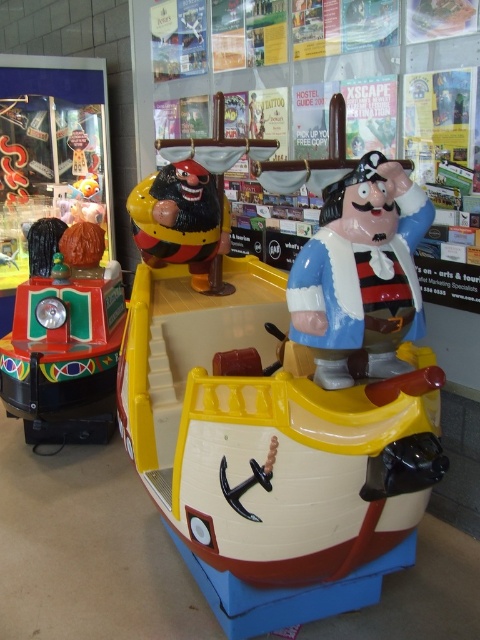
Question: Is shiny plastic pirate ship at center thinner than shiny green plastic train at left?

Choices:
 (A) yes
 (B) no

Answer: (B)

Question: Can you confirm if shiny plastic pirate ship at center is smaller than shiny green plastic train at left?

Choices:
 (A) yes
 (B) no

Answer: (B)

Question: Is shiny plastic pirate at center positioned in front of shiny green plastic train at left?

Choices:
 (A) no
 (B) yes

Answer: (B)

Question: Estimate the real-world distances between objects in this image. Which object is farther from the shiny plastic pirate ship at center?

Choices:
 (A) shiny green plastic train at left
 (B) shiny plastic pirate at center

Answer: (A)

Question: Which of the following is the closest to the observer?

Choices:
 (A) shiny plastic pirate ship at center
 (B) shiny green plastic train at left
 (C) shiny plastic pirate at center

Answer: (A)

Question: Which of the following is the farthest from the observer?

Choices:
 (A) (66, 304)
 (B) (259, 488)

Answer: (A)